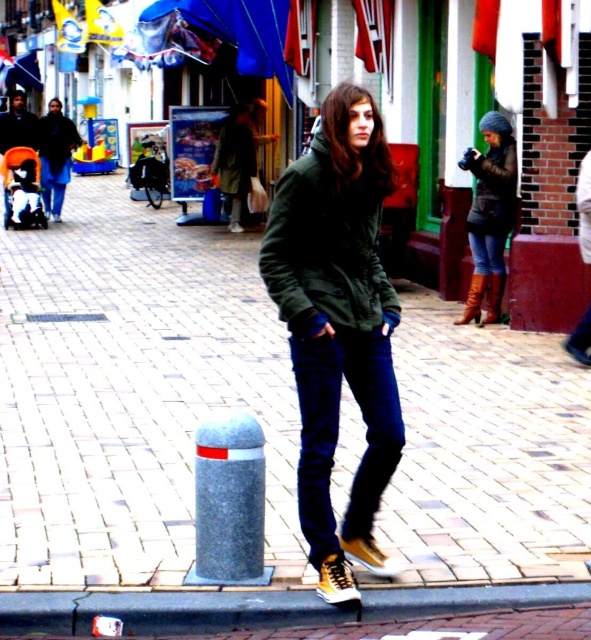
Which is above, dark green matte jacket at upper right or dark green matte jacket at center?

dark green matte jacket at center is above.

Between point (495, 234) and point (232, 122), which one is positioned behind?

The point (232, 122) is behind.

The image size is (591, 640). Find the location of `dark green matte jacket at upper right`. dark green matte jacket at upper right is located at coordinates (493, 188).

Is dark green matte jacket at upper right to the right of dark blue denim jeans at left from the viewer's perspective?

Correct, you'll find dark green matte jacket at upper right to the right of dark blue denim jeans at left.

Is point (501, 230) farther from camera compared to point (63, 172)?

No.

Locate an element on the screen. This screenshot has height=640, width=591. dark green matte jacket at upper right is located at coordinates pyautogui.click(x=493, y=188).

Who is more distant from viewer, (384, 284) or (40, 156)?

Point (40, 156)

Which is in front, point (388, 163) or point (53, 166)?

Point (388, 163) is more forward.

Where is `green fuzzy jacket at center`? The height and width of the screenshot is (640, 591). green fuzzy jacket at center is located at coordinates (326, 248).